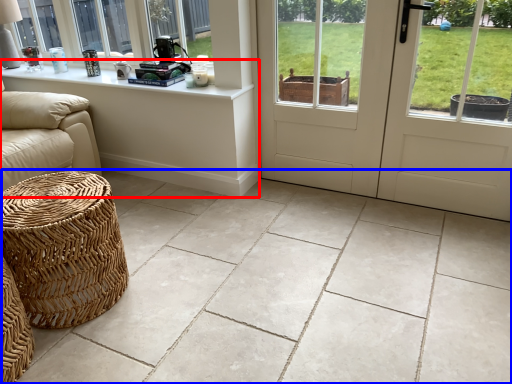
Question: Which point is further to the camera, table (highlighted by a red box) or ceramic tile (highlighted by a blue box)?

Choices:
 (A) table
 (B) ceramic tile

Answer: (A)